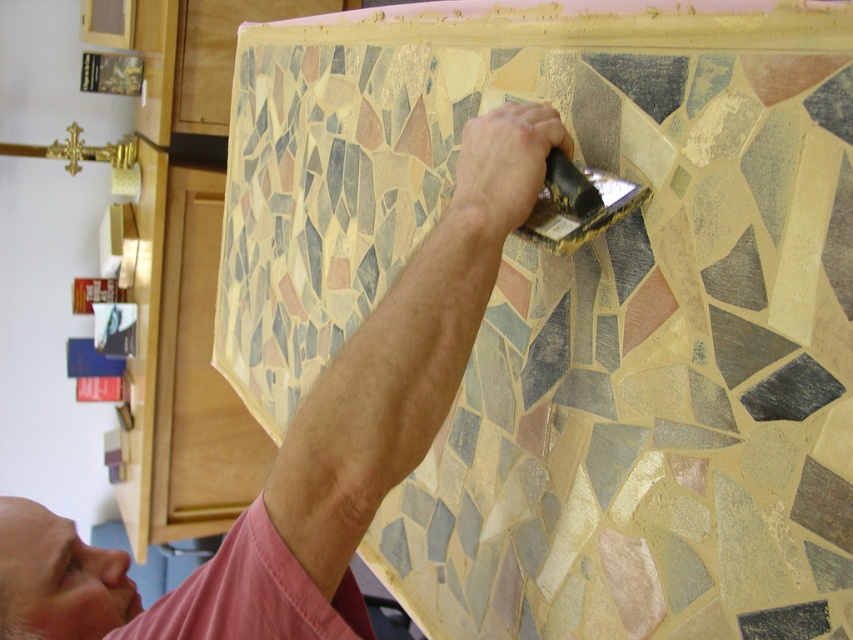
Is point (310, 476) farther from viewer compared to point (563, 168)?

No, it is not.

Looking at this image, who is more forward, [445,280] or [555,189]?

Point [445,280] is more forward.

You are a GUI agent. You are given a task and a screenshot of the screen. Output one action in this format:
    pyautogui.click(x=<x>, y=<y>)
    Task: Click on the pink fabric shirt at upper center
    This screenshot has width=853, height=640.
    Given the screenshot: What is the action you would take?
    pyautogui.click(x=401, y=358)

Identify the location of pink fabric shirt at upper center. pyautogui.click(x=401, y=358).

Can you confirm if pink cotton shirt at upper center is thinner than gold metallic putty knife at upper center?

No, pink cotton shirt at upper center is not thinner than gold metallic putty knife at upper center.

In the scene shown: Which is more to the left, pink cotton shirt at upper center or gold metallic putty knife at upper center?

pink cotton shirt at upper center is more to the left.

The height and width of the screenshot is (640, 853). Describe the element at coordinates (252, 595) in the screenshot. I see `pink cotton shirt at upper center` at that location.

Where is `pink cotton shirt at upper center`? pink cotton shirt at upper center is located at coordinates (252, 595).

Is multicolored mosaic tile at upper center closer to camera compared to pink cotton shirt at upper center?

No, multicolored mosaic tile at upper center is further to the viewer.

From the picture: Can you confirm if multicolored mosaic tile at upper center is positioned to the right of pink cotton shirt at upper center?

Incorrect, multicolored mosaic tile at upper center is not on the right side of pink cotton shirt at upper center.

Is point (677, 598) farther from viewer compared to point (270, 602)?

Yes, point (677, 598) is farther from viewer.

You are a GUI agent. You are given a task and a screenshot of the screen. Output one action in this format:
    pyautogui.click(x=<x>, y=<y>)
    Task: Click on the multicolored mosaic tile at upper center
    This screenshot has height=640, width=853.
    Given the screenshot: What is the action you would take?
    pyautogui.click(x=576, y=317)